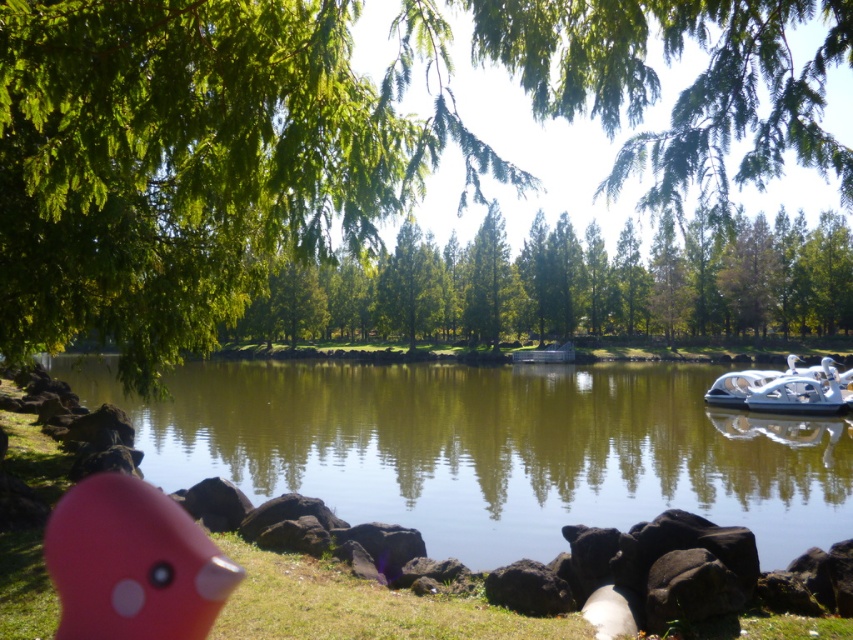
In the scene shown: Can you confirm if green leafy tree at upper center is taller than green smooth water at center?

Correct, green leafy tree at upper center is much taller as green smooth water at center.

Does green leafy tree at upper center have a smaller size compared to green smooth water at center?

No, green leafy tree at upper center is not smaller than green smooth water at center.

Describe the element at coordinates (397, 176) in the screenshot. The height and width of the screenshot is (640, 853). I see `green leafy tree at upper center` at that location.

Where is `green leafy tree at upper center`? The width and height of the screenshot is (853, 640). green leafy tree at upper center is located at coordinates pyautogui.click(x=397, y=176).

Does point (279, 218) come in front of point (791, 410)?

Yes.

The width and height of the screenshot is (853, 640). In order to click on green leafy tree at upper center in this screenshot , I will do `click(397, 176)`.

Is point (664, 218) positioned after point (810, 394)?

Yes, point (664, 218) is farther from viewer.

At what (x,y) coordinates should I click in order to perform the action: click on green leafy tree at upper center. Please return your answer as a coordinate pair (x, y). The height and width of the screenshot is (640, 853). Looking at the image, I should click on (397, 176).

Does green leafy tree at center have a smaller size compared to white plastic boat at right?

Actually, green leafy tree at center might be larger than white plastic boat at right.

The width and height of the screenshot is (853, 640). What do you see at coordinates (573, 285) in the screenshot?
I see `green leafy tree at center` at bounding box center [573, 285].

Find the location of a particular element. The width and height of the screenshot is (853, 640). green leafy tree at center is located at coordinates (573, 285).